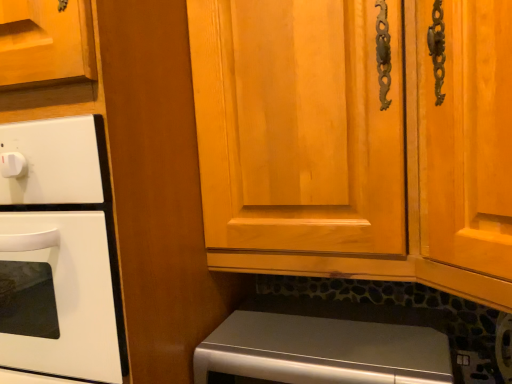
Find the location of a particular element. This screenshot has width=512, height=384. free spot above satin silver microwave at lower center (from a real-world perspective) is located at coordinates click(324, 322).